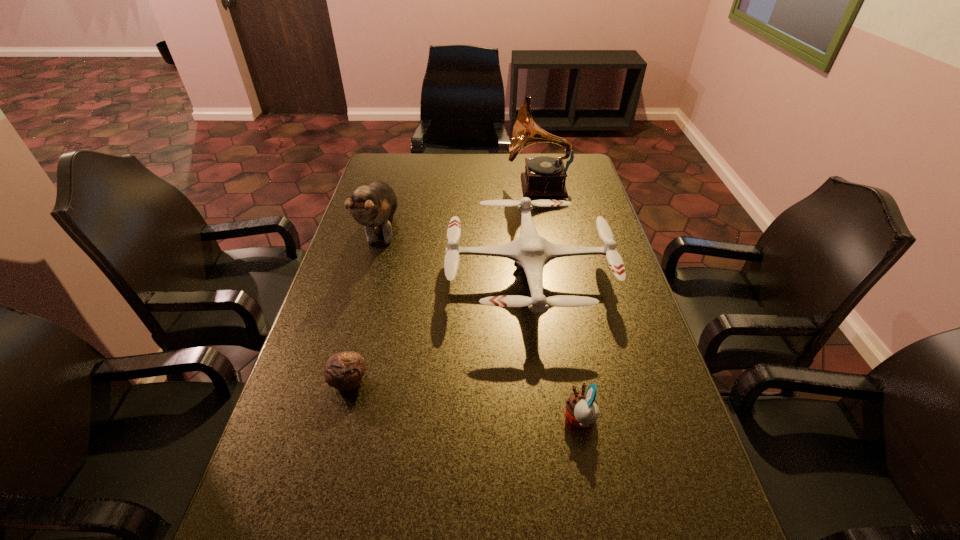
I want to click on empty space that is in between the phonograph_record and the second tallest object, so click(x=461, y=208).

Locate which object is the third closest to the third shortest object. Please provide its 2D coordinates. Your answer should be formatted as a tuple, i.e. [(x, y)], where the tuple contains the x and y coordinates of a point satisfying the conditions above.

[(344, 371)]

What are the coordinates of `the third closest object to the drone` in the screenshot? It's located at (344, 371).

The image size is (960, 540). What are the coordinates of `the second closest muffin to the third tallest object` in the screenshot? It's located at (582, 410).

Where is `vacant region that satisfies the following two spatial constraints: 1. on the horn of the tallest object; 2. at the face of the cat`? Image resolution: width=960 pixels, height=540 pixels. vacant region that satisfies the following two spatial constraints: 1. on the horn of the tallest object; 2. at the face of the cat is located at coordinates (547, 230).

This screenshot has width=960, height=540. What are the coordinates of `vacant space that satisfies the following two spatial constraints: 1. on the horn of the phonograph_record; 2. at the face of the second tallest object` in the screenshot? It's located at (547, 230).